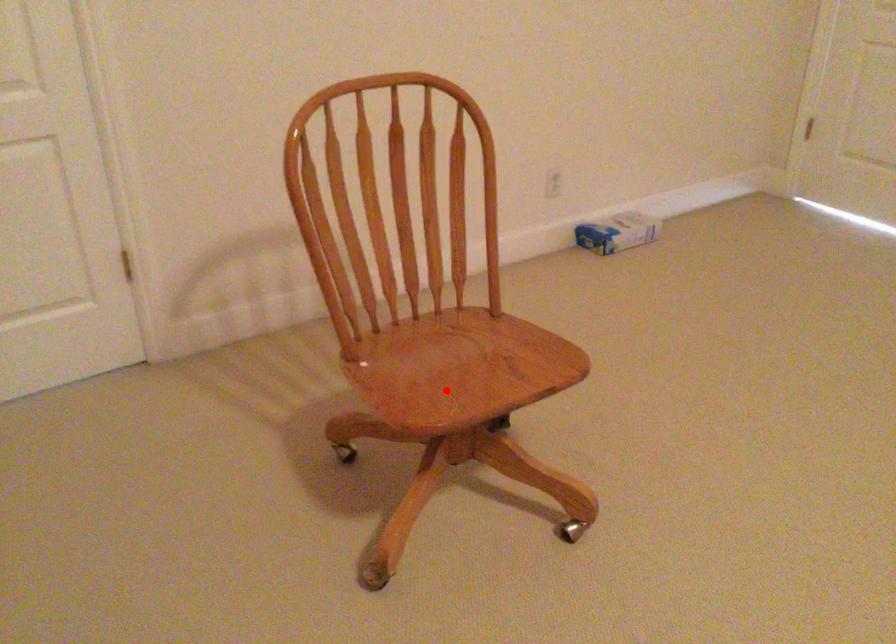
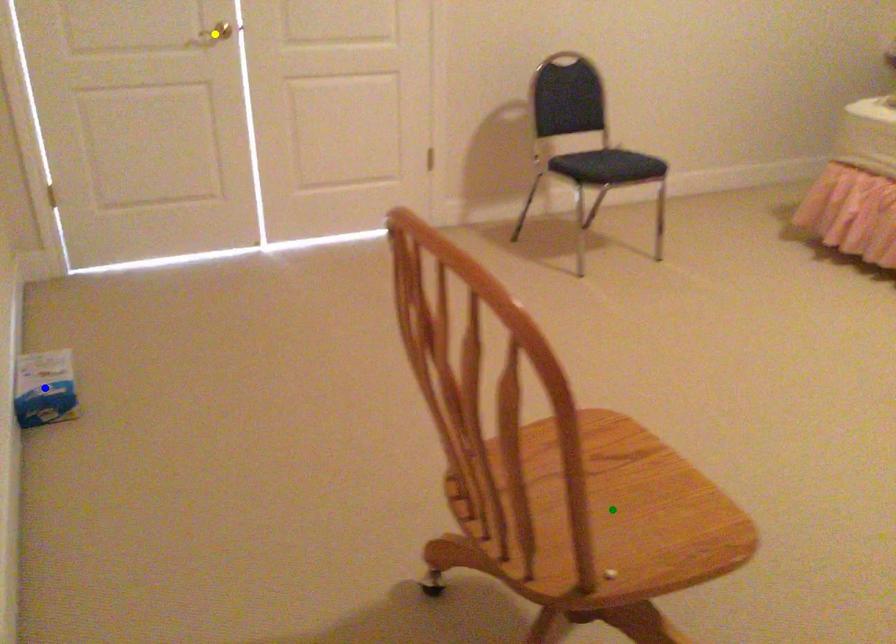
Question: I am providing you with two images of the same scene from different viewpoints. A red point is marked on the first image. You are given multiple points on the second image. Which point in image 2 is actually the same real-world point as the red point in image 1?

Choices:
 (A) blue point
 (B) green point
 (C) yellow point

Answer: (B)